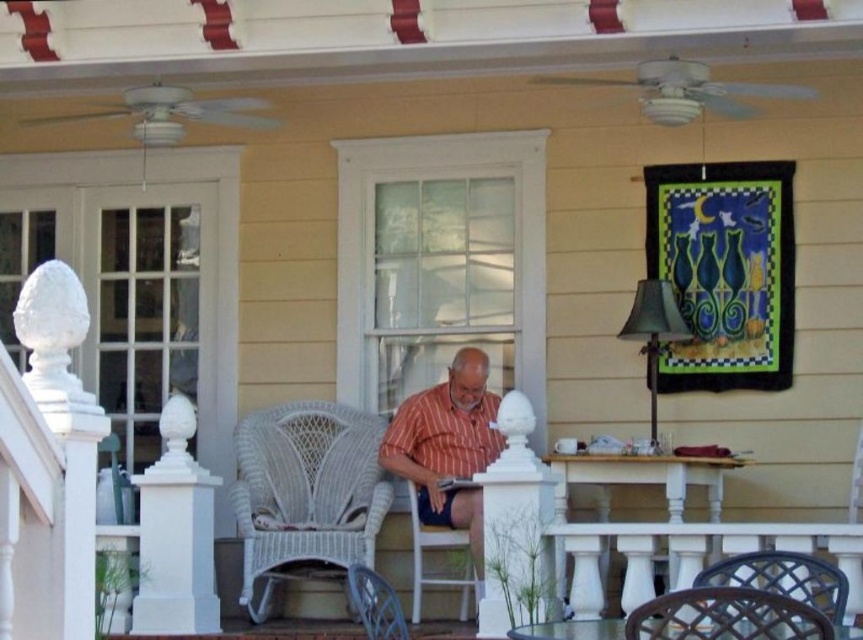
Does white wicker chair at center come in front of wicker chair at lower center?

No.

Who is more forward, (417, 568) or (383, 582)?

Point (383, 582)

At what (x,y) coordinates should I click in order to perform the action: click on white wicker chair at center. Please return your answer as a coordinate pair (x, y). Looking at the image, I should click on (438, 548).

Is white painted wood balustrade at lower center behind black woven chair at lower right?

That is True.

Consider the image. Does white painted wood balustrade at lower center have a larger size compared to black woven chair at lower right?

Yes.

The image size is (863, 640). What do you see at coordinates (695, 554) in the screenshot?
I see `white painted wood balustrade at lower center` at bounding box center [695, 554].

I want to click on white painted wood balustrade at lower center, so click(x=695, y=554).

Can you confirm if white wicker rocking chair at center is thinner than wicker chair at lower center?

In fact, white wicker rocking chair at center might be wider than wicker chair at lower center.

Between white wicker rocking chair at center and wicker chair at lower center, which one appears on the right side from the viewer's perspective?

Positioned to the right is wicker chair at lower center.

Is point (324, 561) positioned in front of point (357, 604)?

No.

The image size is (863, 640). I want to click on white wicker rocking chair at center, so click(306, 496).